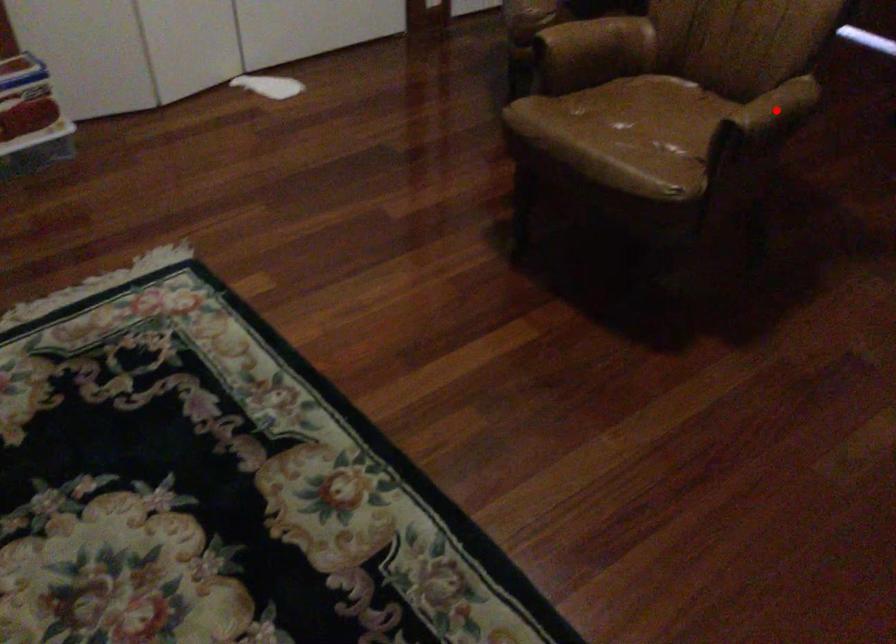
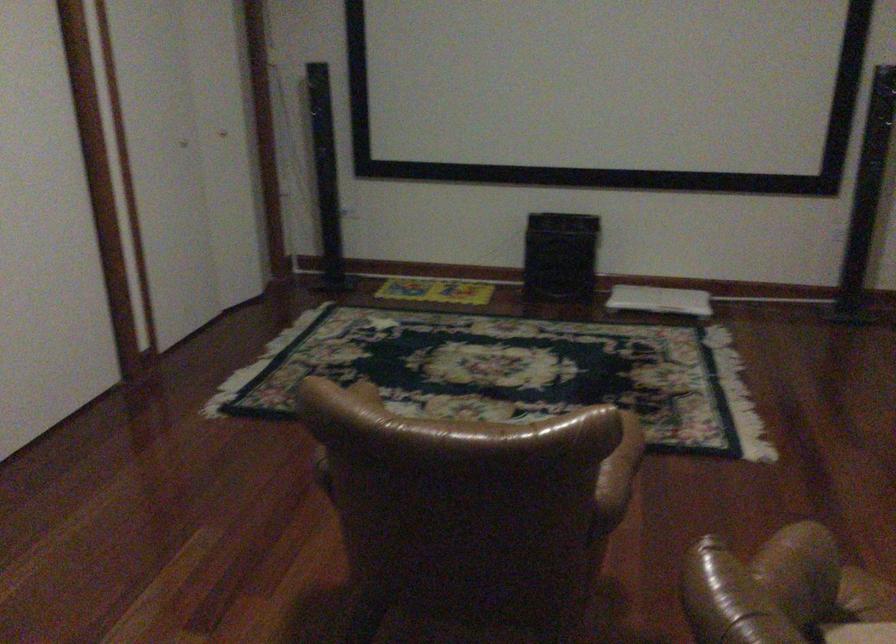
Question: I am providing you with two images of the same scene from different viewpoints. A red point is marked on the first image. At the location where the point appears in image 1, is it still visible in image 2?

Choices:
 (A) Yes
 (B) No

Answer: (B)